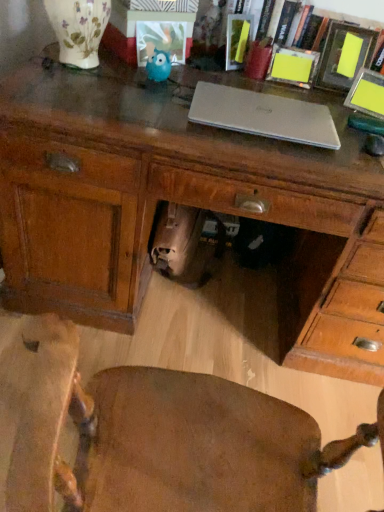
You are a GUI agent. You are given a task and a screenshot of the screen. Output one action in this format:
    pyautogui.click(x=<x>, y=<y>)
    Task: Click on the vacant space that is to the left of silver metallic laptop at center
    This screenshot has width=384, height=512.
    Given the screenshot: What is the action you would take?
    pyautogui.click(x=140, y=108)